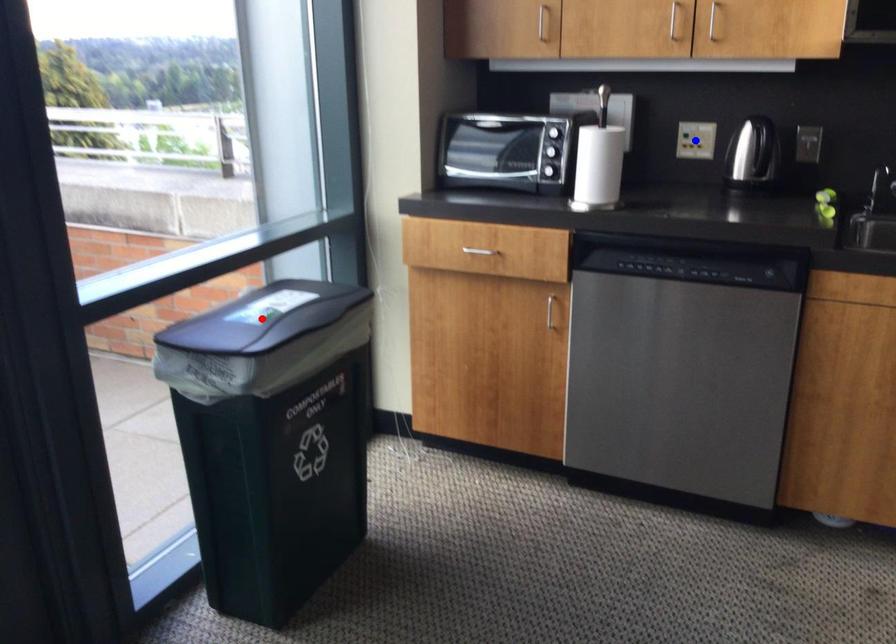
Question: Two points are marked on the image. Which point is closer to the camera?

Choices:
 (A) Blue point is closer.
 (B) Red point is closer.

Answer: (B)